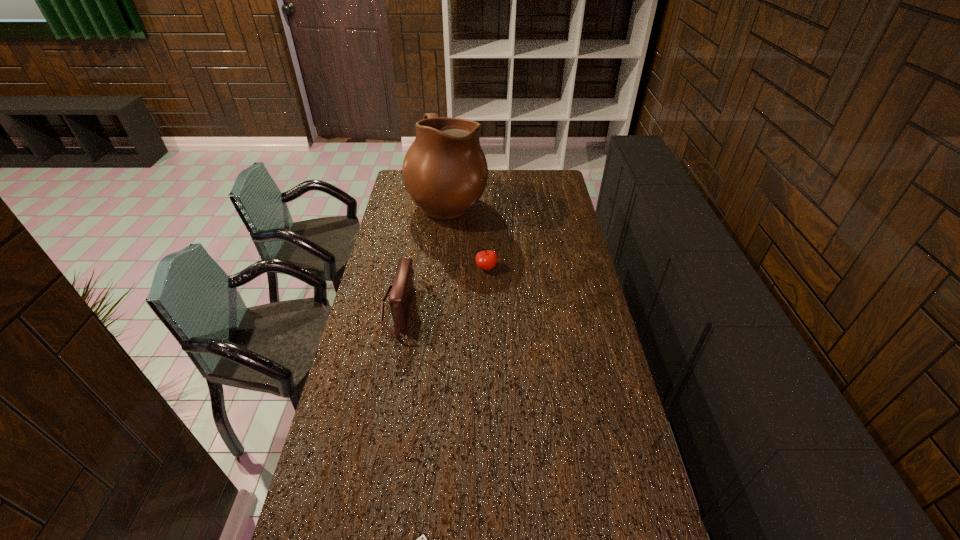
I want to click on free space between the farthest object and the second farthest object, so click(468, 234).

Identify the location of vacant region between the apple and the cream pitcher. Image resolution: width=960 pixels, height=540 pixels. pyautogui.click(x=468, y=234).

This screenshot has width=960, height=540. Find the location of `object that is the closest one to the cream pitcher`. object that is the closest one to the cream pitcher is located at coordinates (487, 259).

At what (x,y) coordinates should I click in order to perform the action: click on object that is the nearest to the third shortest object. Please return your answer as a coordinate pair (x, y). Looking at the image, I should click on (487, 259).

Find the location of `free space that satisfies the following two spatial constraints: 1. at the spout of the third tallest object; 2. on the right side of the cream pitcher`. free space that satisfies the following two spatial constraints: 1. at the spout of the third tallest object; 2. on the right side of the cream pitcher is located at coordinates (442, 267).

The image size is (960, 540). I want to click on vacant area that satisfies the following two spatial constraints: 1. at the spout of the second farthest object; 2. on the right side of the cream pitcher, so click(x=442, y=267).